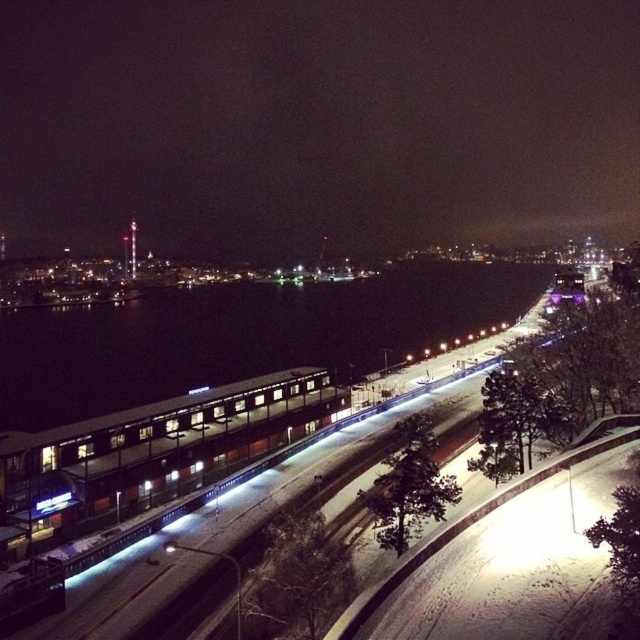
Looking at this image, you are standing at the snow covered road in the foreground of the image. You see two points marked in the scene, point [502,168] and point [29,369]. Which point is closer to you?

Point [502,168] is further to the viewer than point [29,369], so the closer point to you is point [29,369].

You are standing at the edge of the snow covered road and want to reach the dark glassy water at center. Which direction should you walk to get there?

The dark glassy water at center is located at point (x=316, y=124), so you should walk towards the center of the image to reach it.

In the scene shown: You are a photographer planning to capture the reflection of the modern building in the water. Given that you have two options for positioning your tripod, either on the dark glassy water at center or the black water at center, which location would provide a clearer reflection of the modern building?

The dark glassy water at center would provide a clearer reflection of the modern building because it is wider than the black water at center, allowing for a more stable and reflective surface.